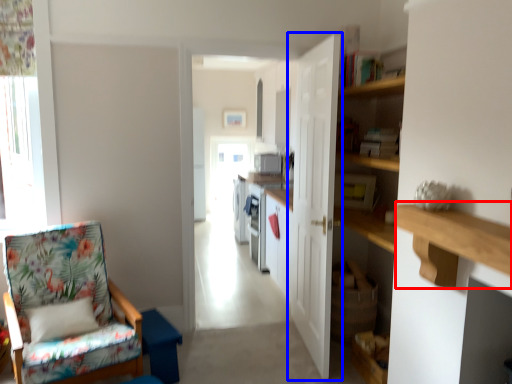
Question: Which object is closer to the camera taking this photo, ledge (highlighted by a red box) or door (highlighted by a blue box)?

Choices:
 (A) ledge
 (B) door

Answer: (A)